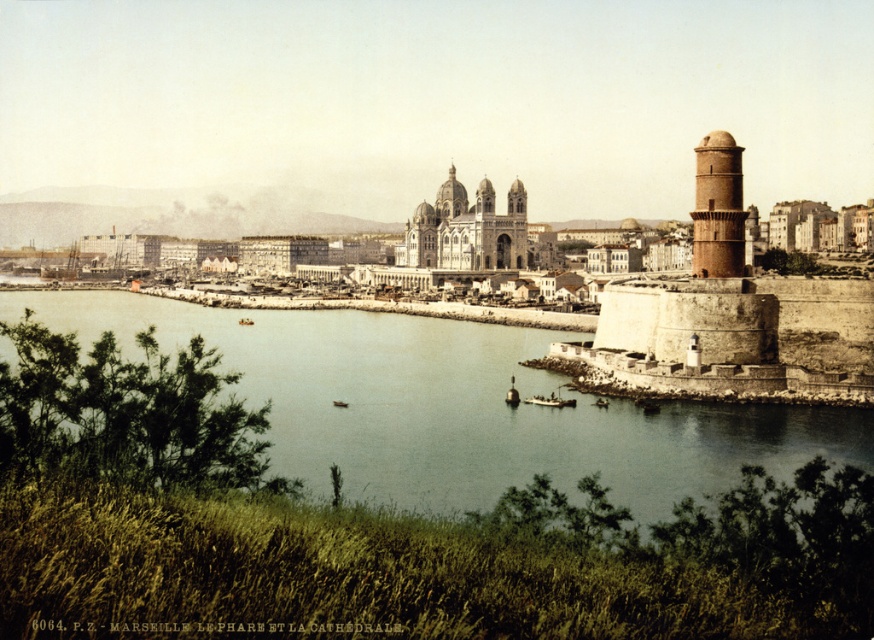
Question: Which of the following is the closest to the observer?

Choices:
 (A) (694, 253)
 (B) (377, 356)

Answer: (A)

Question: Which object is farther from the camera taking this photo?

Choices:
 (A) greenish water at center
 (B) brown textured tower at right
 (C) white stone fort at center

Answer: (C)

Question: Does white stone fort at center appear on the left side of brown textured tower at right?

Choices:
 (A) no
 (B) yes

Answer: (B)

Question: Can you confirm if greenish water at center is positioned above brown textured tower at right?

Choices:
 (A) yes
 (B) no

Answer: (B)

Question: Is greenish water at center further to the viewer compared to brown textured tower at right?

Choices:
 (A) yes
 (B) no

Answer: (B)

Question: Considering the real-world distances, which object is farthest from the brown textured tower at right?

Choices:
 (A) greenish water at center
 (B) white stone fort at center

Answer: (B)